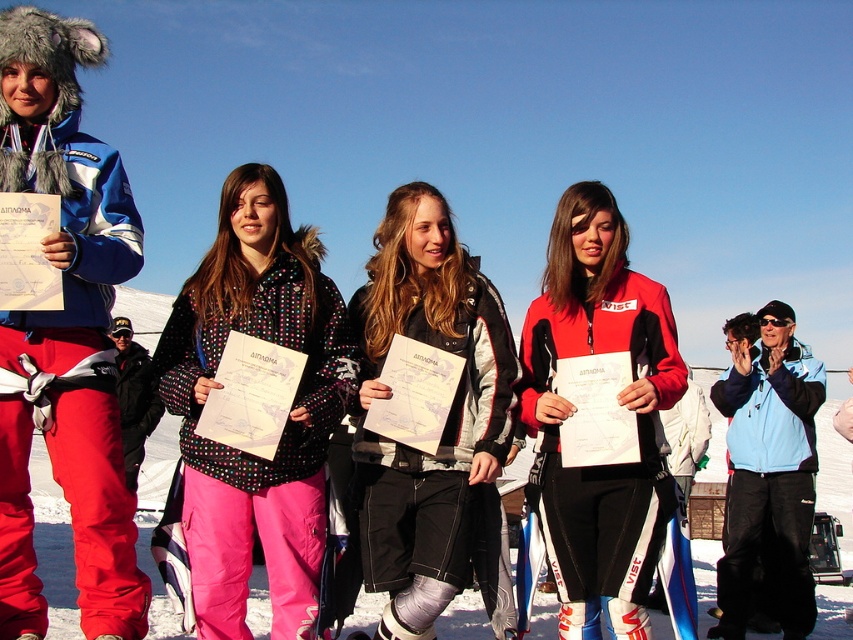
From the picture: Who is lower down, matte blue jacket at left or light blue fleece jacket at right?

light blue fleece jacket at right

Looking at this image, is matte blue jacket at left further to camera compared to light blue fleece jacket at right?

No, matte blue jacket at left is closer to the viewer.

Between point (10, 13) and point (763, 307), which one is positioned in front?

Point (10, 13) is more forward.

This screenshot has width=853, height=640. In order to click on matte blue jacket at left in this screenshot , I will do `click(65, 336)`.

Which of these two, red matte jacket at center or polka dot jacket at center, stands taller?

red matte jacket at center

Who is more distant from viewer, (596, 520) or (341, 390)?

Positioned behind is point (341, 390).

Locate an element on the screen. The height and width of the screenshot is (640, 853). red matte jacket at center is located at coordinates (614, 403).

Who is more distant from viewer, [444,241] or [305,275]?

Point [305,275]

Does black leather jacket at center have a larger size compared to polka dot jacket at center?

Correct, black leather jacket at center is larger in size than polka dot jacket at center.

Measure the distance between black leather jacket at center and camera.

black leather jacket at center and camera are 18.16 meters apart from each other.

Where is `black leather jacket at center`? Image resolution: width=853 pixels, height=640 pixels. black leather jacket at center is located at coordinates (444, 424).